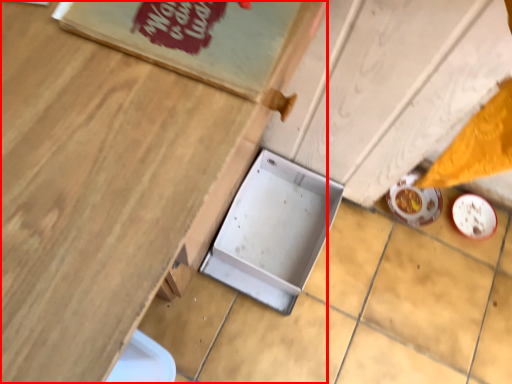
Question: In this image, where is table (annotated by the red box) located relative to box?

Choices:
 (A) right
 (B) left

Answer: (B)